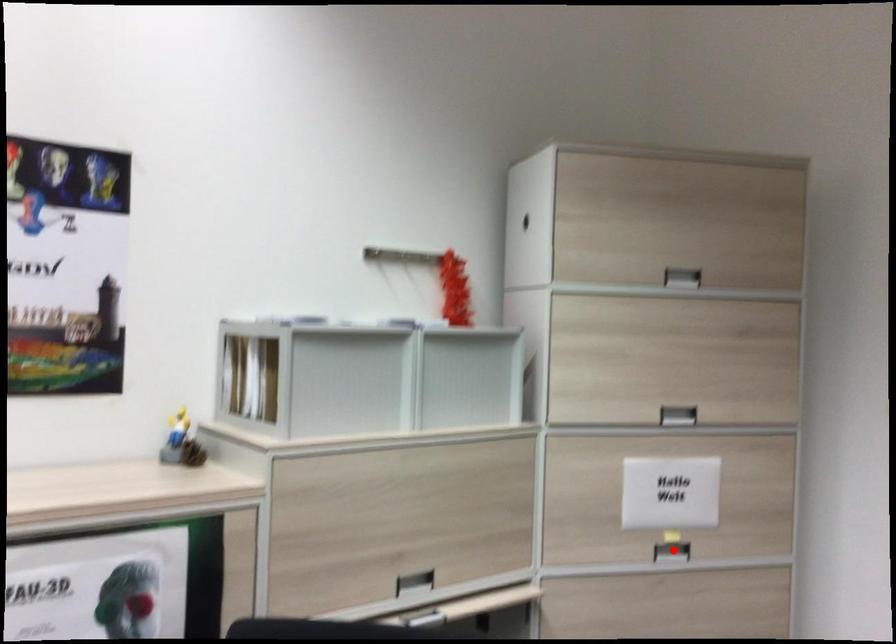
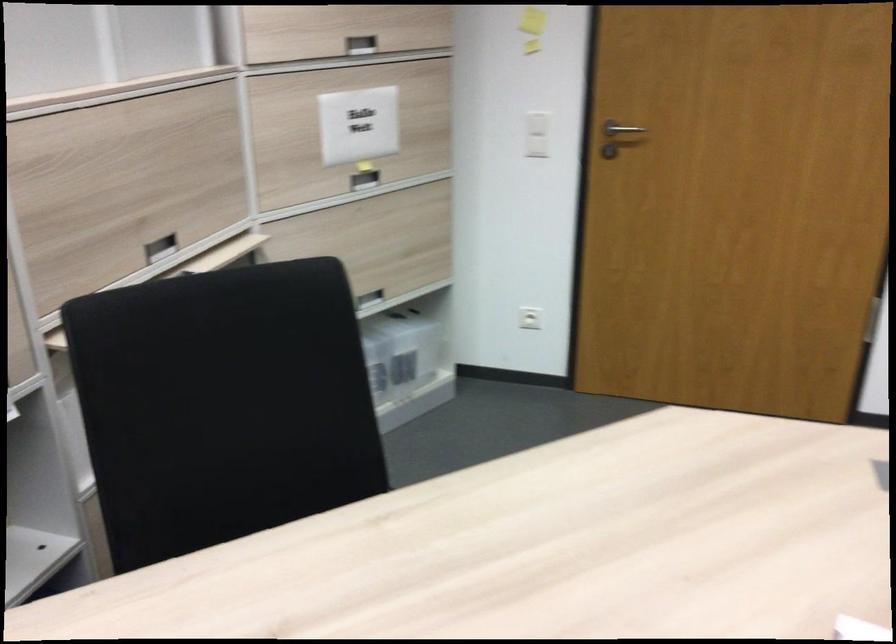
Question: I am providing you with two images of the same scene from different viewpoints. Image1 has a red point marked. In image2, the corresponding 3D location appears at what relative position? Reply with the corresponding letter.

Choices:
 (A) Closer
 (B) Farther

Answer: (B)